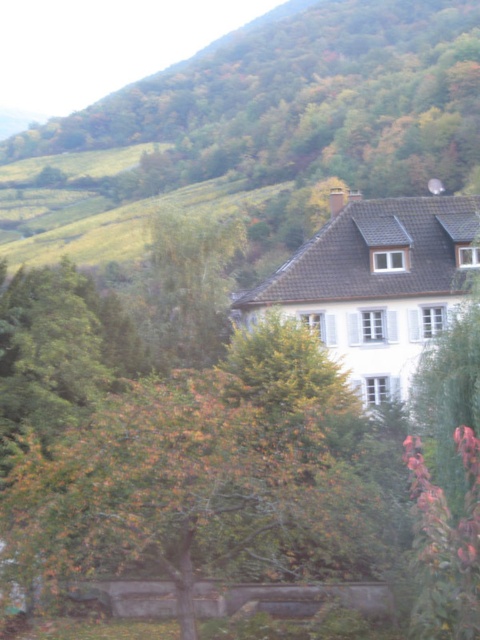
Question: Does green leafy hillside at upper center appear on the left side of autumn leaves tree at center?

Choices:
 (A) yes
 (B) no

Answer: (A)

Question: Observing the image, what is the correct spatial positioning of green leafy hillside at upper center in reference to autumn leaves tree at center?

Choices:
 (A) above
 (B) below

Answer: (A)

Question: Which of the following is the closest to the observer?

Choices:
 (A) green leafy hillside at upper center
 (B) autumn leaves tree at center

Answer: (B)

Question: Does green leafy hillside at upper center have a smaller size compared to autumn leaves tree at center?

Choices:
 (A) no
 (B) yes

Answer: (A)

Question: Which point is farther to the camera?

Choices:
 (A) (103, 449)
 (B) (406, 115)

Answer: (B)